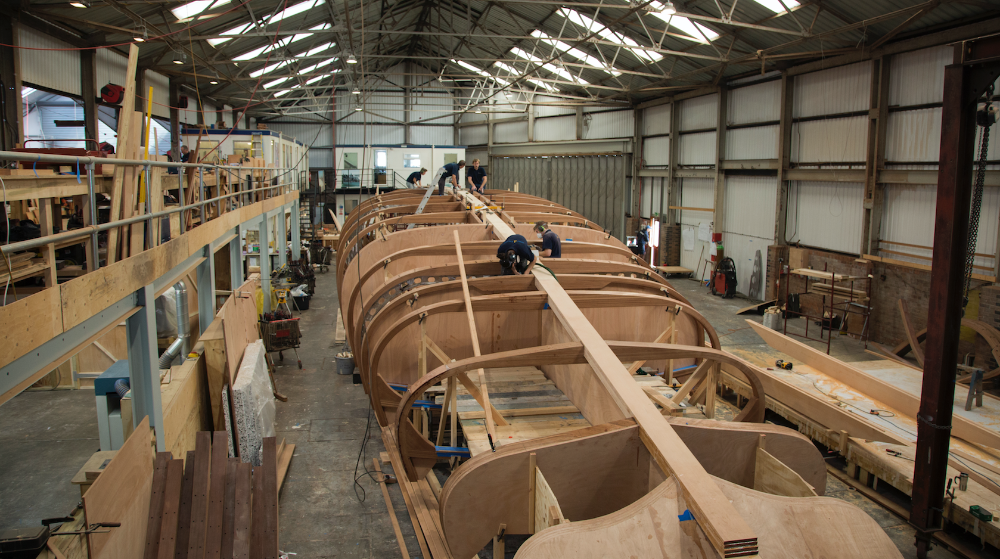
This screenshot has height=559, width=1000. Identify the location of wall. (849, 163), (381, 134), (56, 73).